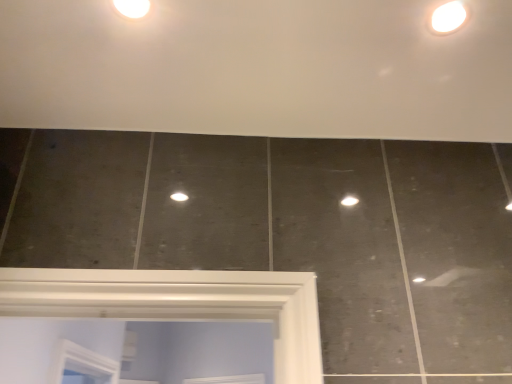
What do you see at coordinates (132, 7) in the screenshot? The height and width of the screenshot is (384, 512). I see `white glossy droplight at upper left` at bounding box center [132, 7].

Locate an element on the screen. This screenshot has width=512, height=384. white glossy droplight at upper left is located at coordinates (132, 7).

What do you see at coordinates (448, 17) in the screenshot? I see `white glossy light fixture at upper right` at bounding box center [448, 17].

Find the location of a particular element. The height and width of the screenshot is (384, 512). white glossy light fixture at upper right is located at coordinates (448, 17).

Where is `white glossy droplight at upper left`? The image size is (512, 384). white glossy droplight at upper left is located at coordinates (132, 7).

Based on their positions, is white glossy droplight at upper left located to the left or right of white glossy light fixture at upper right?

In the image, white glossy droplight at upper left appears on the left side of white glossy light fixture at upper right.

Is white glossy droplight at upper left positioned in front of white glossy light fixture at upper right?

Yes, it is.

Which is closer, (123, 7) or (464, 15)?

The point (123, 7) is closer to the camera.

From the image's perspective, is white glossy droplight at upper left over white glossy light fixture at upper right?

Yes, from the image's perspective, white glossy droplight at upper left is above white glossy light fixture at upper right.

From a real-world perspective, is white glossy droplight at upper left on white glossy light fixture at upper right?

Actually, white glossy droplight at upper left is physically below white glossy light fixture at upper right in the real world.

Considering the relative sizes of white glossy droplight at upper left and white glossy light fixture at upper right in the image provided, is white glossy droplight at upper left wider than white glossy light fixture at upper right?

Yes, white glossy droplight at upper left is wider than white glossy light fixture at upper right.

Is white glossy droplight at upper left shorter than white glossy light fixture at upper right?

Yes, white glossy droplight at upper left is shorter than white glossy light fixture at upper right.

Between white glossy droplight at upper left and white glossy light fixture at upper right, which one has smaller size?

white glossy droplight at upper left is smaller.

Consider the image. Would you say white glossy droplight at upper left contains white glossy light fixture at upper right?

That's incorrect, white glossy light fixture at upper right is not inside white glossy droplight at upper left.

Is there a large distance between white glossy droplight at upper left and white glossy light fixture at upper right?

white glossy droplight at upper left is actually quite close to white glossy light fixture at upper right.

Is white glossy droplight at upper left oriented away from white glossy light fixture at upper right?

No, white glossy droplight at upper left is not facing away from white glossy light fixture at upper right.

Find the location of a particular element. droplight in front of the white glossy light fixture at upper right is located at coordinates (132, 7).

Is white glossy light fixture at upper right to the right of white glossy droplight at upper left from the viewer's perspective?

Indeed, white glossy light fixture at upper right is positioned on the right side of white glossy droplight at upper left.

Between white glossy light fixture at upper right and white glossy droplight at upper left, which one is positioned in front?

white glossy droplight at upper left.

Does point (463, 14) lie in front of point (139, 16)?

That is True.

From the image's perspective, would you say white glossy light fixture at upper right is positioned over white glossy droplight at upper left?

No, from the image's perspective, white glossy light fixture at upper right is not on top of white glossy droplight at upper left.

From a real-world perspective, is white glossy light fixture at upper right located beneath white glossy droplight at upper left?

No, from a real-world perspective, white glossy light fixture at upper right is not under white glossy droplight at upper left.

Considering the relative sizes of white glossy light fixture at upper right and white glossy droplight at upper left in the image provided, is white glossy light fixture at upper right wider than white glossy droplight at upper left?

No.

Is white glossy light fixture at upper right taller or shorter than white glossy droplight at upper left?

In the image, white glossy light fixture at upper right appears to be taller than white glossy droplight at upper left.

Does white glossy light fixture at upper right have a larger size compared to white glossy droplight at upper left?

Yes.

Is white glossy droplight at upper left located within white glossy light fixture at upper right?

No, white glossy light fixture at upper right does not contain white glossy droplight at upper left.

Can you see white glossy light fixture at upper right touching white glossy droplight at upper left?

No, white glossy light fixture at upper right is not with white glossy droplight at upper left.

Could you tell me if white glossy light fixture at upper right is facing white glossy droplight at upper left?

No, white glossy light fixture at upper right is not aimed at white glossy droplight at upper left.

Can you tell me how much white glossy light fixture at upper right and white glossy droplight at upper left differ in facing direction?

There is a 0.0884-degree angle between the facing directions of white glossy light fixture at upper right and white glossy droplight at upper left.

How much distance is there between white glossy light fixture at upper right and white glossy droplight at upper left?

The distance of white glossy light fixture at upper right from white glossy droplight at upper left is 21.47 inches.

Find the location of a particular element. The width and height of the screenshot is (512, 384). light fixture below the white glossy droplight at upper left (from the image's perspective) is located at coordinates (448, 17).

You are a GUI agent. You are given a task and a screenshot of the screen. Output one action in this format:
    pyautogui.click(x=<x>, y=<y>)
    Task: Click on the light fixture that appears below the white glossy droplight at upper left (from the image's perspective)
    The width and height of the screenshot is (512, 384).
    Given the screenshot: What is the action you would take?
    pyautogui.click(x=448, y=17)

Locate an element on the screen. The height and width of the screenshot is (384, 512). light fixture on the right of white glossy droplight at upper left is located at coordinates (448, 17).